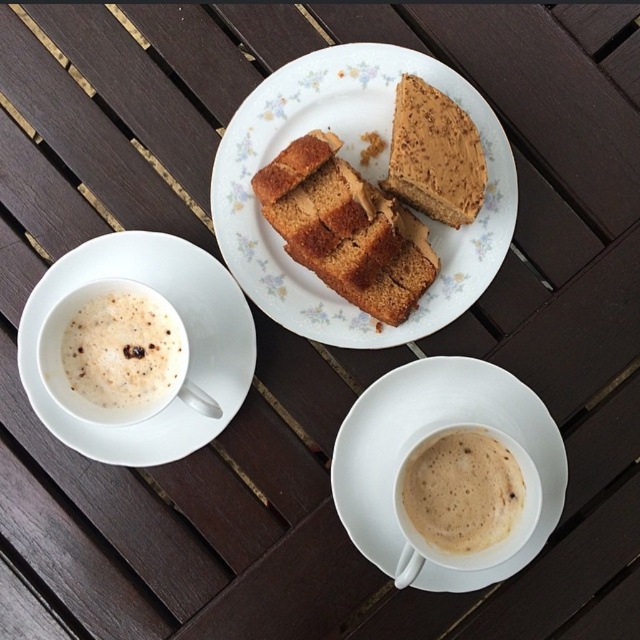
You are a barista trying to place a new cup of coffee on the table. The table has a white ceramic saucer at left and a white frothy coffee at upper left. Where should you place the new cup to avoid knocking over the existing items?

The white ceramic saucer at left is below the white frothy coffee at upper left, so placing the new cup near the center of the table would avoid disturbing either item.